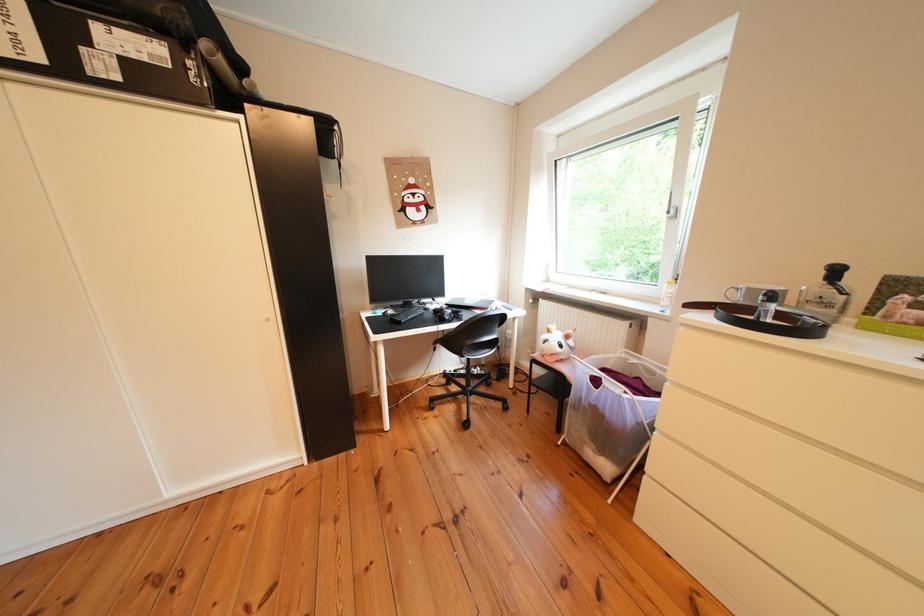
The width and height of the screenshot is (924, 616). Find the location of `pump bottle dispenser`. pump bottle dispenser is located at coordinates (837, 283).